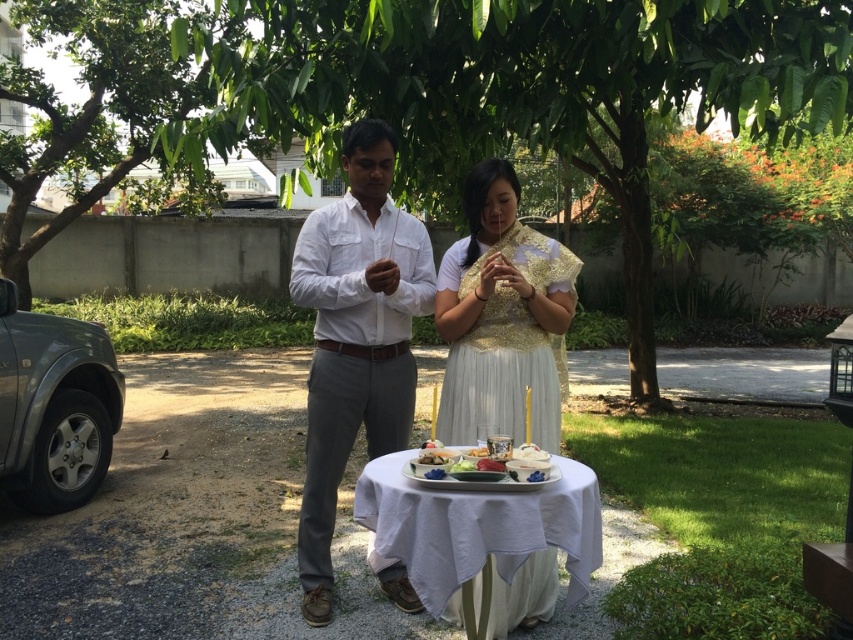
Question: Which object is positioned farthest from the white cloth-covered table at center?

Choices:
 (A) smooth white plate at center
 (B) white cotton shirt at center
 (C) gold embroidered blouse at center

Answer: (B)

Question: Is white cotton shirt at center smaller than gold embroidered blouse at center?

Choices:
 (A) no
 (B) yes

Answer: (A)

Question: Which of the following is the farthest from the observer?

Choices:
 (A) [x=538, y=481]
 (B) [x=396, y=596]
 (C) [x=450, y=348]

Answer: (B)

Question: Is gold embroidered blouse at center to the left of white cloth-covered table at center from the viewer's perspective?

Choices:
 (A) no
 (B) yes

Answer: (A)

Question: Is white cotton shirt at center wider than smooth white plate at center?

Choices:
 (A) yes
 (B) no

Answer: (A)

Question: Which of the following is the farthest from the observer?

Choices:
 (A) (357, 480)
 (B) (495, 480)
 (C) (306, 550)

Answer: (A)